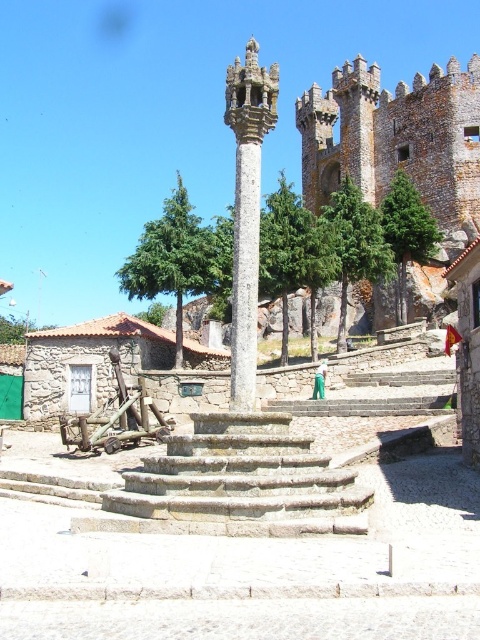
You are an architect examining the stone steps at center and the smooth stone column at center in the image. Which of the two structures is larger in size?

The smooth stone column at center is larger in size compared to the stone steps at center.

You are standing at the base of the stone column and want to walk towards the cobblestone pathway. Which direction should you move relative to the point marked by the coordinates point (235, 484)?

The point (235, 484) represents the stone steps at center. To reach the cobblestone pathway from the column base, you should move away from the point (235, 484) towards the pathway that extends outward from the steps.